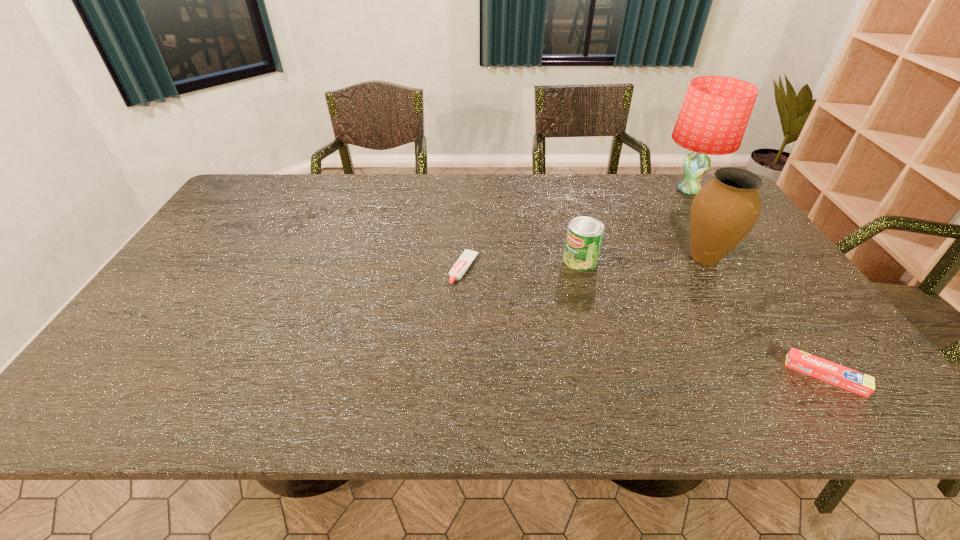
Locate an element on the screen. This screenshot has height=540, width=960. vacant region located 0.350m on the front-facing side of the lampshade is located at coordinates (557, 190).

At what (x,y) coordinates should I click in order to perform the action: click on free spot located on the front-facing side of the lampshade. Please return your answer as a coordinate pair (x, y). This screenshot has height=540, width=960. Looking at the image, I should click on tap(578, 190).

At what (x,y) coordinates should I click in order to perform the action: click on vacant position located 0.200m on the back of the second tallest object. Please return your answer as a coordinate pair (x, y). Image resolution: width=960 pixels, height=540 pixels. Looking at the image, I should click on (673, 204).

The height and width of the screenshot is (540, 960). Identify the location of vacant space located 0.110m on the front of the second object from left to right. [590, 299].

Identify the location of blank space located 0.090m on the right of the left toothpaste. The image size is (960, 540). (512, 269).

Image resolution: width=960 pixels, height=540 pixels. I want to click on blank space located 0.330m on the back of the nearer toothpaste, so click(x=746, y=262).

Where is `object situated at the far edge`? The image size is (960, 540). object situated at the far edge is located at coordinates (714, 115).

Locate an element on the screen. object that is positioned at the near edge is located at coordinates (849, 379).

I want to click on lampshade at the right edge, so click(x=714, y=115).

Locate an element on the screen. This screenshot has width=960, height=540. urn at the right edge is located at coordinates (724, 211).